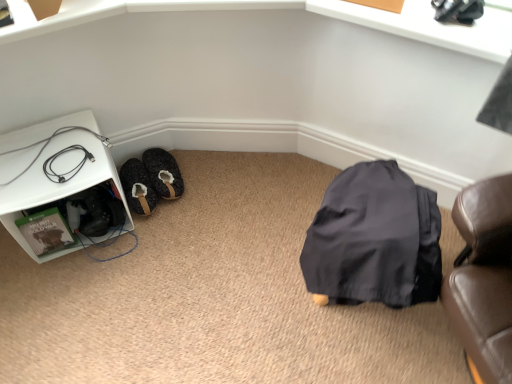
You are a GUI agent. You are given a task and a screenshot of the screen. Output one action in this format:
    pyautogui.click(x=<x>, y=<y>)
    Task: Click on the free region on the left part of black rubber cable at lower left
    This screenshot has width=512, height=384.
    Given the screenshot: What is the action you would take?
    pyautogui.click(x=26, y=166)